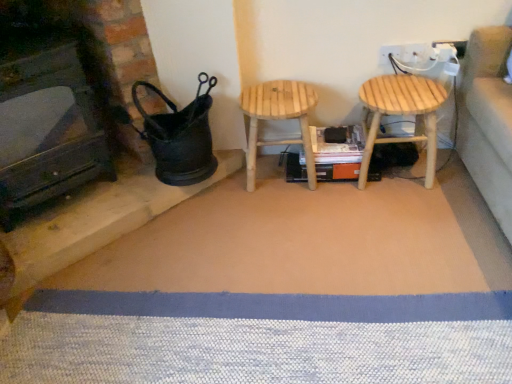
The image size is (512, 384). In order to click on natural wood stool at right, acting as the 1th stool starting from the right in this screenshot , I will do `click(401, 114)`.

Considering the points (98, 173) and (264, 117), which point is behind, point (98, 173) or point (264, 117)?

The point (98, 173) is more distant.

Is black matte fireplace at left turned away from natural wood stool at center, marked as the 1th stool in a left-to-right arrangement?

That's not correct — black matte fireplace at left is not looking away from natural wood stool at center, marked as the 1th stool in a left-to-right arrangement.

Is black matte fireplace at left located outside natural wood stool at center, which is counted as the 2th stool, starting from the right?

That's correct, black matte fireplace at left is outside of natural wood stool at center, which is counted as the 2th stool, starting from the right.

In the scene shown: From a real-world perspective, between black matte fireplace at left and natural wood stool at center, marked as the 1th stool in a left-to-right arrangement, who is vertically higher?

In real-world perspective, black matte fireplace at left is above.

How many degrees apart are the facing directions of natural wood stool at right, acting as the 1th stool starting from the right, and black matte fireplace at left?

The angle between the facing direction of natural wood stool at right, acting as the 1th stool starting from the right, and the facing direction of black matte fireplace at left is 46.4 degrees.

Relative to black matte fireplace at left, is natural wood stool at right, acting as the 1th stool starting from the right, in front or behind?

natural wood stool at right, acting as the 1th stool starting from the right, is behind black matte fireplace at left.

Is natural wood stool at right, acting as the 1th stool starting from the right, facing away from black matte fireplace at left?

That's not correct — natural wood stool at right, acting as the 1th stool starting from the right, is not looking away from black matte fireplace at left.

Can you confirm if natural wood stool at right, arranged as the second stool when viewed from the left, is bigger than black matte fireplace at left?

No.

From a real-world perspective, which object stands above the other?

From a 3D spatial view, natural wood stool at right, acting as the 1th stool starting from the right, is above.

Which is in front, point (426, 119) or point (286, 112)?

The point (426, 119) is closer to the camera.

Which is behind, natural wood stool at right, arranged as the second stool when viewed from the left, or natural wood stool at center, marked as the 1th stool in a left-to-right arrangement?

natural wood stool at center, marked as the 1th stool in a left-to-right arrangement, is further away from the camera.

Image resolution: width=512 pixels, height=384 pixels. I want to click on stool above the natural wood stool at center, which is counted as the 2th stool, starting from the right (from the image's perspective), so click(401, 114).

From the image's perspective, which one is positioned higher, natural wood stool at center, marked as the 1th stool in a left-to-right arrangement, or black matte fireplace at left?

black matte fireplace at left is shown above in the image.

Find the location of `the 2nd stool directly beneath the black matte fireplace at left (from a real-world perspective)`. the 2nd stool directly beneath the black matte fireplace at left (from a real-world perspective) is located at coordinates (278, 119).

Based on their positions, is natural wood stool at center, marked as the 1th stool in a left-to-right arrangement, located to the left or right of black matte fireplace at left?

In the image, natural wood stool at center, marked as the 1th stool in a left-to-right arrangement, appears on the right side of black matte fireplace at left.

Can we say natural wood stool at center, which is counted as the 2th stool, starting from the right, lies outside black matte fireplace at left?

Yes, natural wood stool at center, which is counted as the 2th stool, starting from the right, is located beyond the bounds of black matte fireplace at left.

Is point (250, 95) more distant than point (416, 98)?

Yes, point (250, 95) is behind point (416, 98).

Are natural wood stool at center, which is counted as the 2th stool, starting from the right, and natural wood stool at right, acting as the 1th stool starting from the right, beside each other?

They are not placed beside each other.

In the scene shown: Could you tell me if natural wood stool at center, marked as the 1th stool in a left-to-right arrangement, is facing natural wood stool at right, acting as the 1th stool starting from the right?

No, natural wood stool at center, marked as the 1th stool in a left-to-right arrangement, does not turn towards natural wood stool at right, acting as the 1th stool starting from the right.

From a real-world perspective, is natural wood stool at center, which is counted as the 2th stool, starting from the right, located beneath natural wood stool at right, arranged as the second stool when viewed from the left?

Yes, from a real-world perspective, natural wood stool at center, which is counted as the 2th stool, starting from the right, is beneath natural wood stool at right, arranged as the second stool when viewed from the left.

Consider the image. Is natural wood stool at right, acting as the 1th stool starting from the right, at the back of black matte fireplace at left?

No, black matte fireplace at left is not facing away from natural wood stool at right, acting as the 1th stool starting from the right.

Considering the sizes of objects black matte fireplace at left and natural wood stool at right, acting as the 1th stool starting from the right, in the image provided, who is thinner, black matte fireplace at left or natural wood stool at right, acting as the 1th stool starting from the right,?

With smaller width is natural wood stool at right, acting as the 1th stool starting from the right.

Could you measure the distance between black matte fireplace at left and natural wood stool at right, acting as the 1th stool starting from the right?

black matte fireplace at left is 1.28 meters from natural wood stool at right, acting as the 1th stool starting from the right.

Is black matte fireplace at left in front of or behind natural wood stool at right, acting as the 1th stool starting from the right, in the image?

In the image, black matte fireplace at left appears in front of natural wood stool at right, acting as the 1th stool starting from the right.

Locate an element on the screen. The height and width of the screenshot is (384, 512). fireplace above the natural wood stool at center, marked as the 1th stool in a left-to-right arrangement (from the image's perspective) is located at coordinates (52, 131).

Where is `stool that is the 2nd object to the right of the black matte fireplace at left, starting at the anchor`? The image size is (512, 384). stool that is the 2nd object to the right of the black matte fireplace at left, starting at the anchor is located at coordinates (401, 114).

From the image, which object appears to be farther from black matte fireplace at left, natural wood stool at center, which is counted as the 2th stool, starting from the right, or natural wood stool at right, arranged as the second stool when viewed from the left?

natural wood stool at right, arranged as the second stool when viewed from the left.

Considering their positions, is natural wood stool at right, acting as the 1th stool starting from the right, positioned closer to black matte fireplace at left than natural wood stool at center, which is counted as the 2th stool, starting from the right?

Among the two, natural wood stool at center, which is counted as the 2th stool, starting from the right, is located nearer to black matte fireplace at left.

Estimate the real-world distances between objects in this image. Which object is further from natural wood stool at center, which is counted as the 2th stool, starting from the right, natural wood stool at right, acting as the 1th stool starting from the right, or black matte fireplace at left?

black matte fireplace at left is positioned further to the anchor natural wood stool at center, which is counted as the 2th stool, starting from the right.

Based on their spatial positions, is black matte fireplace at left or natural wood stool at center, marked as the 1th stool in a left-to-right arrangement, closer to natural wood stool at right, acting as the 1th stool starting from the right?

natural wood stool at center, marked as the 1th stool in a left-to-right arrangement, is positioned closer to the anchor natural wood stool at right, acting as the 1th stool starting from the right.

Which object lies further to the anchor point natural wood stool at right, acting as the 1th stool starting from the right, natural wood stool at center, which is counted as the 2th stool, starting from the right, or black matte fireplace at left?

Based on the image, black matte fireplace at left appears to be further to natural wood stool at right, acting as the 1th stool starting from the right.

When comparing their distances from natural wood stool at center, which is counted as the 2th stool, starting from the right, does black matte fireplace at left or natural wood stool at right, acting as the 1th stool starting from the right, seem closer?

Among the two, natural wood stool at right, acting as the 1th stool starting from the right, is located nearer to natural wood stool at center, which is counted as the 2th stool, starting from the right.

At what (x,y) coordinates should I click in order to perform the action: click on stool located between black matte fireplace at left and natural wood stool at right, arranged as the second stool when viewed from the left, in the left-right direction. Please return your answer as a coordinate pair (x, y). The width and height of the screenshot is (512, 384). Looking at the image, I should click on (278, 119).